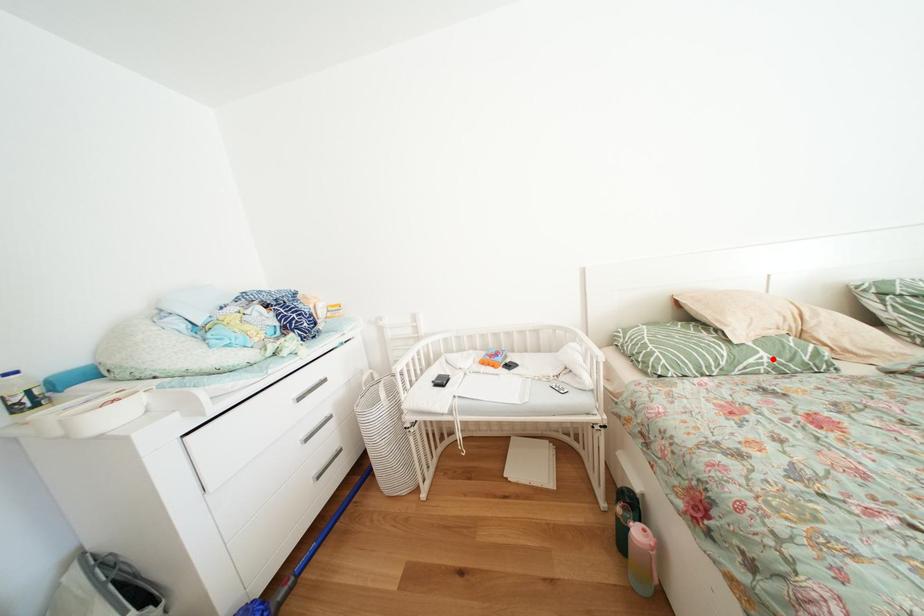
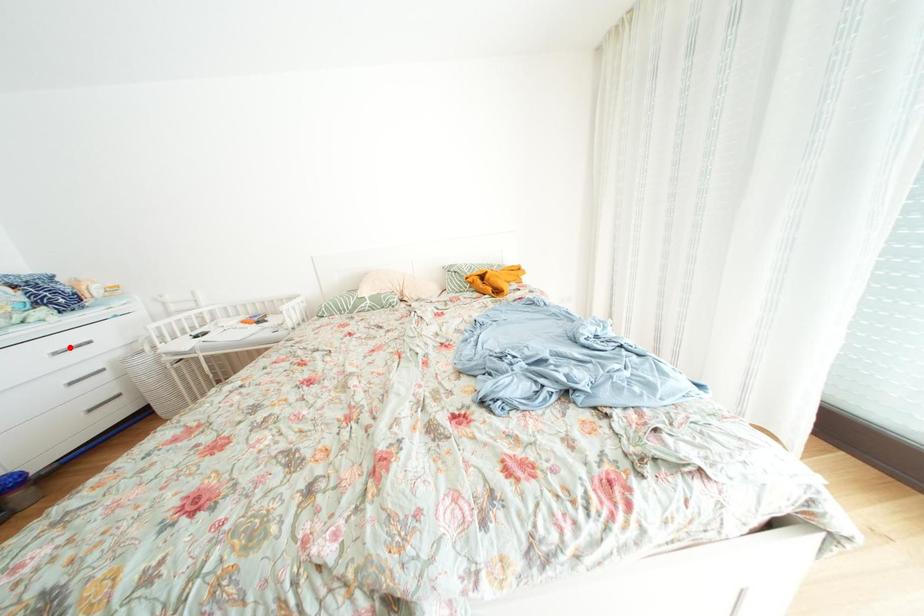
I am providing you with two images of the same scene from different viewpoints. A red point is marked on the first image and another point is marked on the second image. Is the marked point in image1 the same physical position as the marked point in image2?

No